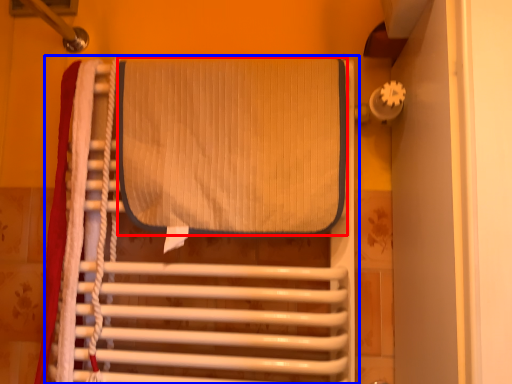
Question: Which of the following is the closest to the observer, wide (highlighted by a red box) or furniture (highlighted by a blue box)?

Choices:
 (A) wide
 (B) furniture

Answer: (B)